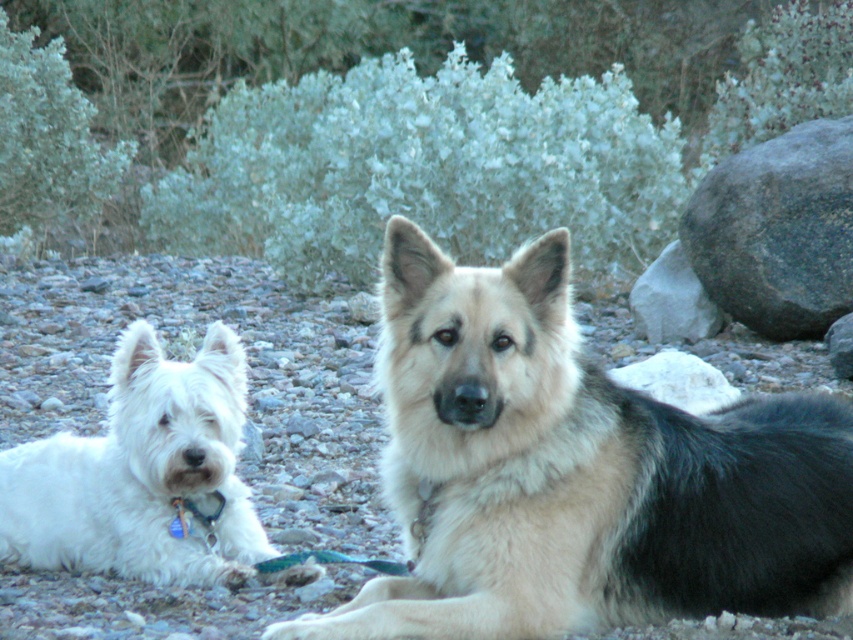
Is gray rough rock at right wider than gray rock at right?

Yes, gray rough rock at right is wider than gray rock at right.

Which of these two, gray rough rock at right or gray rock at right, stands taller?

With more height is gray rough rock at right.

Does point (822, 272) lie behind point (656, 312)?

No, (822, 272) is closer to viewer.

Identify the location of gray rough rock at right. (776, 230).

The width and height of the screenshot is (853, 640). Describe the element at coordinates (577, 474) in the screenshot. I see `light brown fur at center` at that location.

Which is more to the right, light brown fur at center or gray rough rock at right?

From the viewer's perspective, gray rough rock at right appears more on the right side.

Does point (701, 516) come farther from viewer compared to point (747, 212)?

No, it is not.

Find the location of `light brown fur at center`. light brown fur at center is located at coordinates (577, 474).

Is point (193, 358) behind point (770, 218)?

No, it is not.

Is white fluffy dog at left to the right of gray rough rock at right from the viewer's perspective?

No, white fluffy dog at left is not to the right of gray rough rock at right.

What do you see at coordinates (143, 474) in the screenshot?
I see `white fluffy dog at left` at bounding box center [143, 474].

You are a GUI agent. You are given a task and a screenshot of the screen. Output one action in this format:
    pyautogui.click(x=<x>, y=<y>)
    Task: Click on the white fluffy dog at left
    
    Given the screenshot: What is the action you would take?
    pyautogui.click(x=143, y=474)